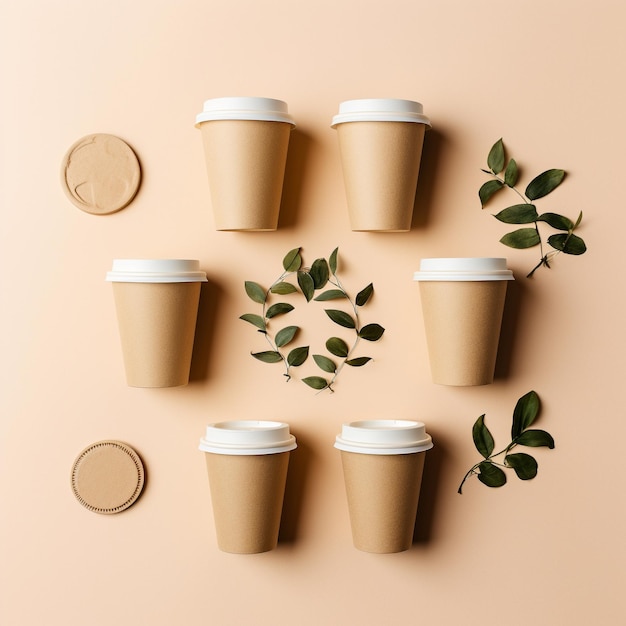
Where is `cups that hold liquid`? cups that hold liquid is located at coordinates (262, 488), (399, 468), (476, 319), (382, 193), (255, 171), (178, 327).